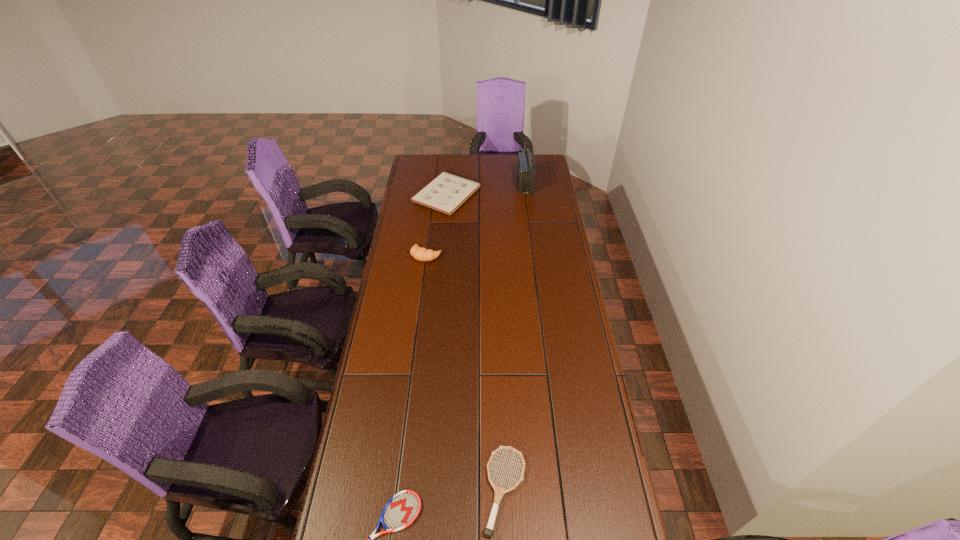
What are the coordinates of `the rightmost object` in the screenshot? It's located at (525, 171).

Where is `the tallest object`? Image resolution: width=960 pixels, height=540 pixels. the tallest object is located at coordinates (525, 171).

Where is `the third farthest object`? The width and height of the screenshot is (960, 540). the third farthest object is located at coordinates (422, 254).

This screenshot has height=540, width=960. What are the coordinates of `crescent roll` in the screenshot? It's located at (422, 254).

Find the location of a particular element. notepad is located at coordinates (446, 192).

This screenshot has width=960, height=540. Find the location of `the fourth tallest object`. the fourth tallest object is located at coordinates (499, 492).

In order to click on the taller tennis racket in this screenshot , I will do `click(499, 492)`.

Where is `free region located on the front panel of the radio receiver`? This screenshot has width=960, height=540. free region located on the front panel of the radio receiver is located at coordinates (494, 184).

At what (x,y) coordinates should I click in order to perform the action: click on vacant region located on the front panel of the radio receiver. Please return your answer as a coordinate pair (x, y). Looking at the image, I should click on (447, 184).

This screenshot has width=960, height=540. Identify the location of vacant space located on the front panel of the radio receiver. (474, 184).